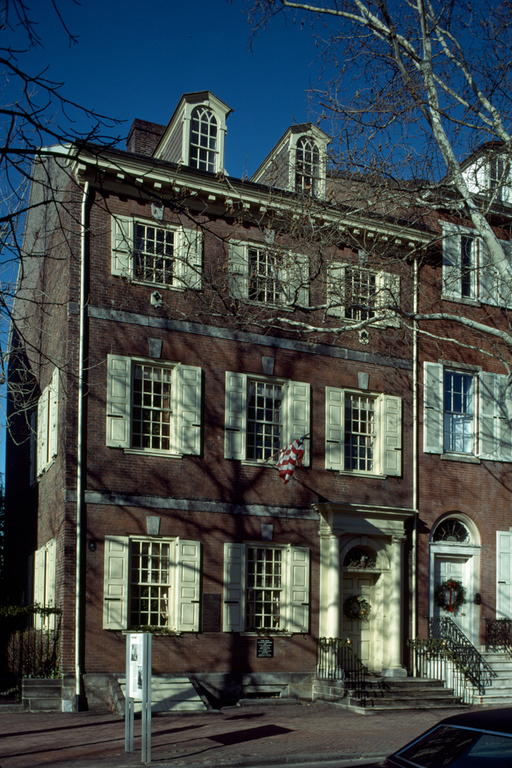
The height and width of the screenshot is (768, 512). Find the location of `floor dividers`. floor dividers is located at coordinates (194, 502), (216, 329).